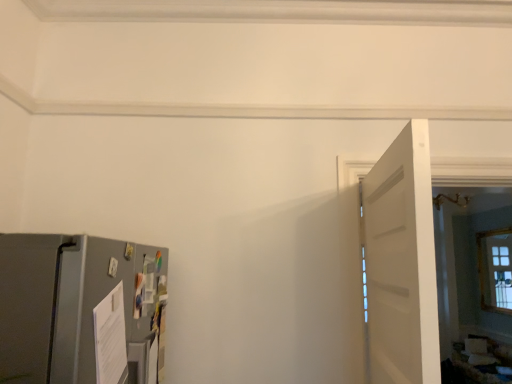
The image size is (512, 384). Describe the element at coordinates (402, 262) in the screenshot. I see `white matte door at right` at that location.

Where is `white matte door at right`? Image resolution: width=512 pixels, height=384 pixels. white matte door at right is located at coordinates (402, 262).

Measure the distance between point (370, 298) and camera.

A distance of 1.90 meters exists between point (370, 298) and camera.

What do you see at coordinates (81, 310) in the screenshot?
I see `satin gray refrigerator at lower left` at bounding box center [81, 310].

Where is `satin gray refrigerator at lower left`? The width and height of the screenshot is (512, 384). satin gray refrigerator at lower left is located at coordinates (81, 310).

The image size is (512, 384). Find the location of `white matte door at right`. white matte door at right is located at coordinates pyautogui.click(x=402, y=262).

Which is more to the left, satin gray refrigerator at lower left or white matte door at right?

From the viewer's perspective, satin gray refrigerator at lower left appears more on the left side.

Is satin gray refrigerator at lower left further to the viewer compared to white matte door at right?

No, satin gray refrigerator at lower left is in front of white matte door at right.

Is point (27, 305) positioned behind point (364, 204)?

No, (27, 305) is in front of (364, 204).

From the image's perspective, which object appears higher, satin gray refrigerator at lower left or white matte door at right?

From the image's view, white matte door at right is above.

From the picture: From a real-world perspective, is satin gray refrigerator at lower left positioned under white matte door at right based on gravity?

Yes, from a real-world perspective, satin gray refrigerator at lower left is beneath white matte door at right.

Which object is thinner, satin gray refrigerator at lower left or white matte door at right?

With smaller width is white matte door at right.

Which of these two, satin gray refrigerator at lower left or white matte door at right, stands shorter?

satin gray refrigerator at lower left is shorter.

In the scene shown: Who is smaller, satin gray refrigerator at lower left or white matte door at right?

white matte door at right is smaller.

Is satin gray refrigerator at lower left not within white matte door at right?

Yes.

Is satin gray refrigerator at lower left directly adjacent to white matte door at right?

No, satin gray refrigerator at lower left is not beside white matte door at right.

Is satin gray refrigerator at lower left aimed at white matte door at right?

Yes, satin gray refrigerator at lower left is oriented towards white matte door at right.

At what (x,y) coordinates should I click in order to perform the action: click on door above the satin gray refrigerator at lower left (from a real-world perspective). Please return your answer as a coordinate pair (x, y). Image resolution: width=512 pixels, height=384 pixels. Looking at the image, I should click on (402, 262).

Does white matte door at right appear on the left side of satin gray refrigerator at lower left?

Incorrect, white matte door at right is not on the left side of satin gray refrigerator at lower left.

Which object is closer to the camera, white matte door at right or satin gray refrigerator at lower left?

satin gray refrigerator at lower left is more forward.

Considering the positions of point (424, 161) and point (154, 275), is point (424, 161) closer or farther from the camera than point (154, 275)?

Point (424, 161) is closer to the camera than point (154, 275).

From the image's perspective, which one is positioned higher, white matte door at right or satin gray refrigerator at lower left?

white matte door at right.

From a real-world perspective, is white matte door at right positioned above or below satin gray refrigerator at lower left?

white matte door at right is situated higher than satin gray refrigerator at lower left in the real world.

Considering the relative sizes of white matte door at right and satin gray refrigerator at lower left in the image provided, is white matte door at right thinner than satin gray refrigerator at lower left?

Correct, the width of white matte door at right is less than that of satin gray refrigerator at lower left.

Can you confirm if white matte door at right is shorter than satin gray refrigerator at lower left?

No, white matte door at right is not shorter than satin gray refrigerator at lower left.

In terms of size, does white matte door at right appear bigger or smaller than satin gray refrigerator at lower left?

Clearly, white matte door at right is smaller in size than satin gray refrigerator at lower left.

Would you say white matte door at right is inside or outside satin gray refrigerator at lower left?

white matte door at right is not enclosed by satin gray refrigerator at lower left.

Is white matte door at right not near satin gray refrigerator at lower left?

That's not correct — white matte door at right is a little close to satin gray refrigerator at lower left.

Does white matte door at right turn towards satin gray refrigerator at lower left?

No, white matte door at right is not turned towards satin gray refrigerator at lower left.

What's the angular difference between white matte door at right and satin gray refrigerator at lower left's facing directions?

The angular difference between white matte door at right and satin gray refrigerator at lower left is 5.4 degrees.

How much distance is there between white matte door at right and satin gray refrigerator at lower left?

white matte door at right and satin gray refrigerator at lower left are 33.88 inches apart from each other.

Identify the location of door lying on the right of satin gray refrigerator at lower left. The width and height of the screenshot is (512, 384). (402, 262).

Where is `appliance on the left of white matte door at right`? appliance on the left of white matte door at right is located at coordinates (81, 310).

What are the coordinates of `appliance in front of the white matte door at right` in the screenshot? It's located at (81, 310).